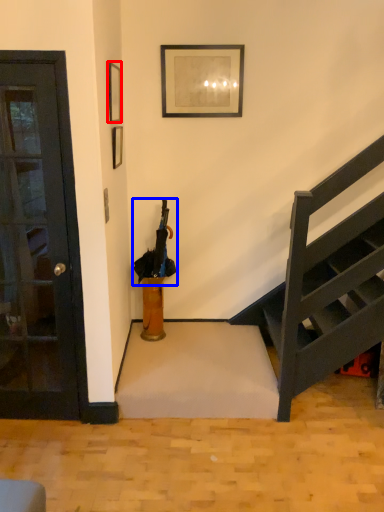
Question: Among these objects, which one is farthest to the camera, picture frame (highlighted by a red box) or umbrella (highlighted by a blue box)?

Choices:
 (A) picture frame
 (B) umbrella

Answer: (B)